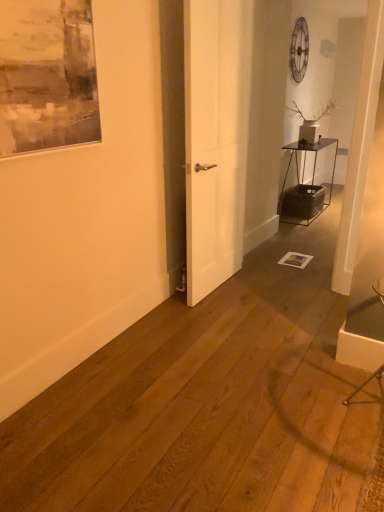
Question: Can you confirm if matte gray painting at upper left is taller than metallic black table at right?

Choices:
 (A) yes
 (B) no

Answer: (B)

Question: Is matte gray painting at upper left positioned behind metallic black table at right?

Choices:
 (A) no
 (B) yes

Answer: (A)

Question: Considering the relative positions of matte gray painting at upper left and metallic black table at right in the image provided, is matte gray painting at upper left to the left of metallic black table at right from the viewer's perspective?

Choices:
 (A) no
 (B) yes

Answer: (B)

Question: Would you say matte gray painting at upper left is a long distance from metallic black table at right?

Choices:
 (A) no
 (B) yes

Answer: (B)

Question: Considering the relative positions of matte gray painting at upper left and metallic black table at right in the image provided, is matte gray painting at upper left in front of metallic black table at right?

Choices:
 (A) yes
 (B) no

Answer: (A)

Question: Is matte gray painting at upper left at the right side of metallic black table at right?

Choices:
 (A) yes
 (B) no

Answer: (B)

Question: Is metallic silver armchair at lower right wider than metallic black table at right?

Choices:
 (A) no
 (B) yes

Answer: (B)

Question: Considering the relative positions of metallic silver armchair at lower right and metallic black table at right in the image provided, is metallic silver armchair at lower right to the right of metallic black table at right from the viewer's perspective?

Choices:
 (A) no
 (B) yes

Answer: (A)

Question: Is metallic silver armchair at lower right surrounding metallic black table at right?

Choices:
 (A) yes
 (B) no

Answer: (B)

Question: Is metallic silver armchair at lower right beside metallic black table at right?

Choices:
 (A) no
 (B) yes

Answer: (A)

Question: Considering the relative sizes of metallic silver armchair at lower right and metallic black table at right in the image provided, is metallic silver armchair at lower right taller than metallic black table at right?

Choices:
 (A) yes
 (B) no

Answer: (B)

Question: Can you confirm if metallic silver armchair at lower right is bigger than metallic black table at right?

Choices:
 (A) yes
 (B) no

Answer: (B)

Question: Could matte gray painting at upper left be considered to be inside metallic black table at right?

Choices:
 (A) no
 (B) yes

Answer: (A)